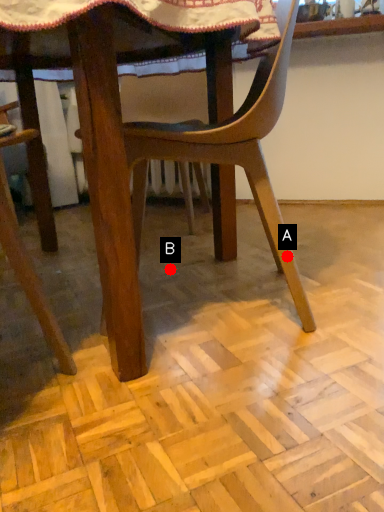
Question: Two points are circled on the image, labeled by A and B beside each circle. Which point appears farthest from the camera in this image?

Choices:
 (A) A is further
 (B) B is further

Answer: (B)